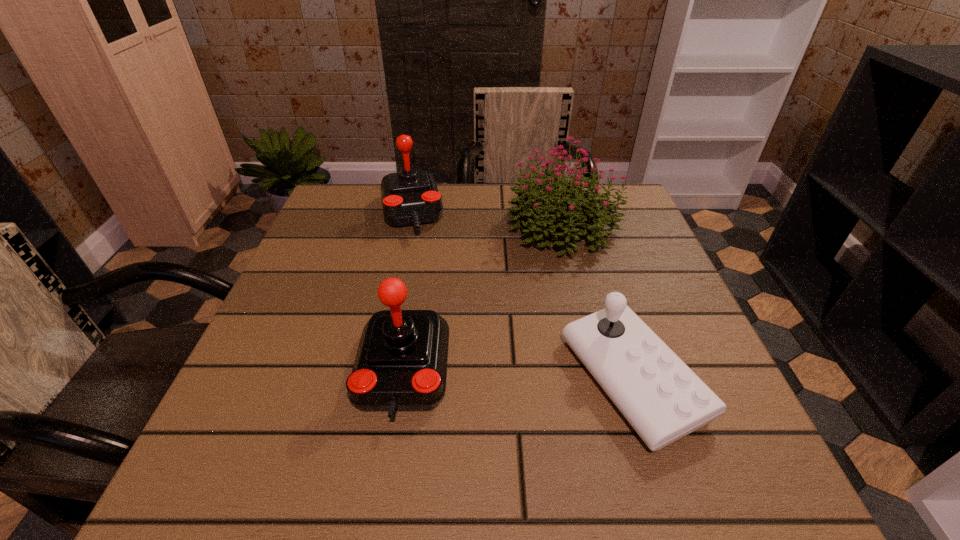
Locate an element on the screen. This screenshot has width=960, height=540. vacant region between the farthest joystick and the bouquet is located at coordinates (488, 220).

Locate an element on the screen. This screenshot has width=960, height=540. free area in between the farthest joystick and the bouquet is located at coordinates (488, 220).

Identify the location of vacant region between the bouquet and the rightmost joystick. The width and height of the screenshot is (960, 540). coord(598,302).

Locate an element on the screen. This screenshot has height=540, width=960. empty space that is in between the bouquet and the farthest joystick is located at coordinates (488, 220).

Find the location of a particular element. The image size is (960, 540). empty space between the farthest joystick and the shortest object is located at coordinates (522, 296).

In order to click on unoccupied area between the rightmost joystick and the farthest joystick in this screenshot , I will do `click(522, 296)`.

The image size is (960, 540). I want to click on free area in between the farthest joystick and the shortest joystick, so click(x=522, y=296).

Locate an element on the screen. the third closest object to the bouquet is located at coordinates (401, 363).

Identify which object is the second closest to the bouquet. Please provide its 2D coordinates. Your answer should be formatted as a tuple, i.e. [(x, y)], where the tuple contains the x and y coordinates of a point satisfying the conditions above.

[(663, 400)]

The height and width of the screenshot is (540, 960). In order to click on joystick that can be found as the second closest to the farthest joystick in this screenshot , I will do `click(663, 400)`.